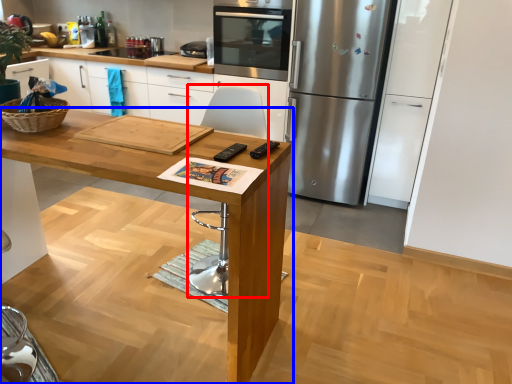
Question: Among these objects, which one is nearest to the camera, chair (highlighted by a red box) or table (highlighted by a blue box)?

Choices:
 (A) chair
 (B) table

Answer: (B)